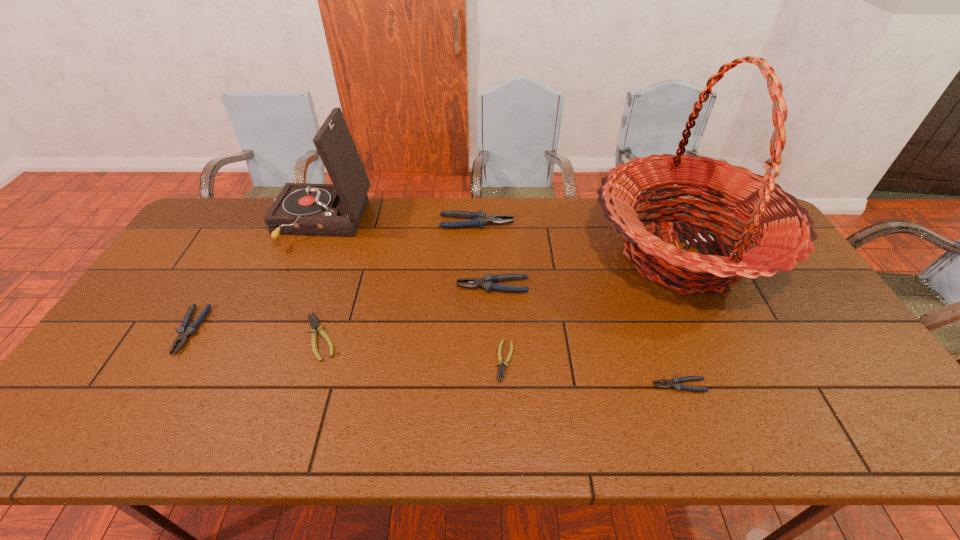
The height and width of the screenshot is (540, 960). I want to click on object that is at the right edge, so click(783, 235).

Locate an element on the screen. object that is positioned at the far right corner is located at coordinates (783, 235).

At what (x,y) coordinates should I click in order to perform the action: click on vacant space at the far edge of the desktop. Please return your answer as a coordinate pair (x, y). This screenshot has width=960, height=540. Looking at the image, I should click on (515, 233).

The height and width of the screenshot is (540, 960). I want to click on vacant point at the near edge, so click(518, 419).

Locate an element on the screen. This screenshot has height=540, width=960. vacant region at the left edge of the desktop is located at coordinates (222, 253).

This screenshot has height=540, width=960. I want to click on free space at the right edge, so [x=811, y=308].

Locate an element on the screen. vacant region at the far left corner of the desktop is located at coordinates (228, 231).

Image resolution: width=960 pixels, height=540 pixels. Find the location of `vacant region at the near right corner of the desktop`. vacant region at the near right corner of the desktop is located at coordinates (844, 428).

This screenshot has width=960, height=540. I want to click on vacant region between the fifth shortest pliers and the basket, so click(x=587, y=271).

Where is `vacant space that's between the leftmost gray pliers and the phonograph record`? This screenshot has height=540, width=960. vacant space that's between the leftmost gray pliers and the phonograph record is located at coordinates (255, 277).